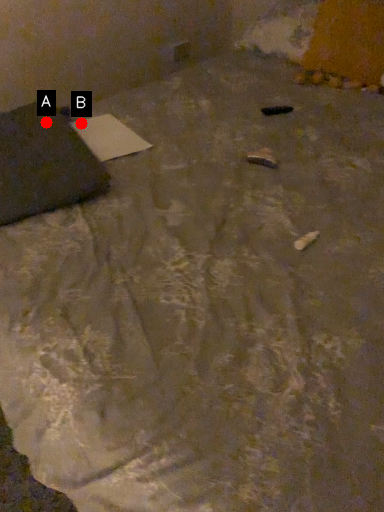
Question: Two points are circled on the image, labeled by A and B beside each circle. Which point is closer to the camera taking this photo?

Choices:
 (A) A is closer
 (B) B is closer

Answer: (A)